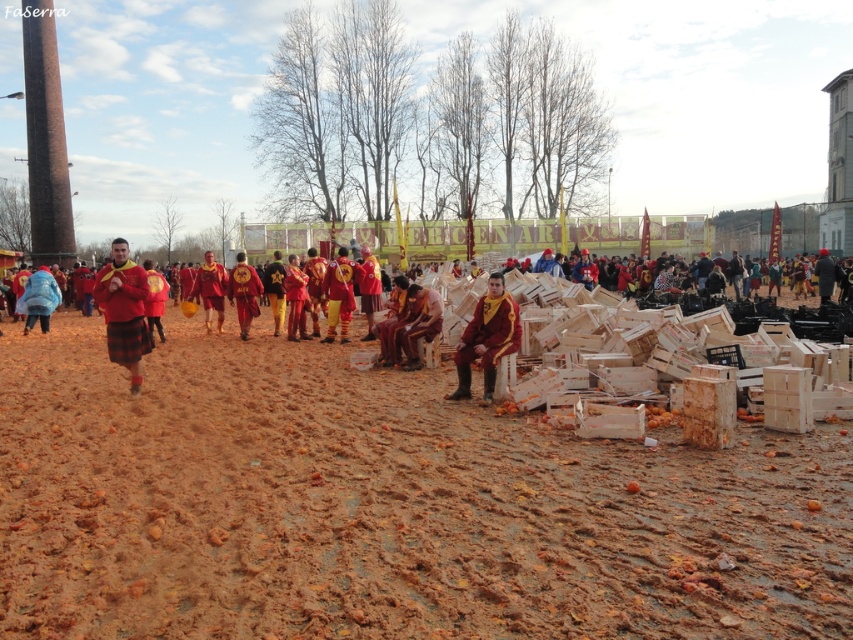
Question: Estimate the real-world distances between objects in this image. Which object is farther from the matte red kilt at left?

Choices:
 (A) matte red and yellow uniform at center
 (B) blue fabric jacket at left
 (C) shiny gold helmet at center

Answer: (B)

Question: Which point is farther to the camera?

Choices:
 (A) (128, 275)
 (B) (473, 326)
 (C) (33, 272)
 (D) (335, 273)

Answer: (C)

Question: Which object is the farthest from the yellow fabric pants at center?

Choices:
 (A) shiny red fabric at center
 (B) shiny gold helmet at center
 (C) brown sandy dirt at center
 (D) matte yellow jacket at center

Answer: (C)

Question: Is matte red shirt at center below matte red jacket at center?

Choices:
 (A) yes
 (B) no

Answer: (A)

Question: Does matte red shirt at center appear on the right side of matte red jacket at center?

Choices:
 (A) yes
 (B) no

Answer: (B)

Question: Does matte red and yellow uniform at center have a smaller size compared to blue fabric jacket at left?

Choices:
 (A) no
 (B) yes

Answer: (A)